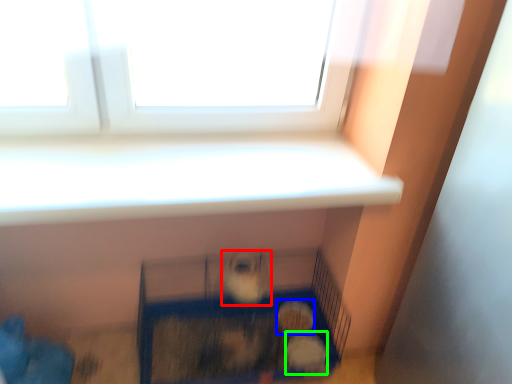
Question: Considering the real-world distances, which object is farthest from animal (highlighted by a red box)? animal (highlighted by a blue box) or animal (highlighted by a green box)?

Choices:
 (A) animal
 (B) animal

Answer: (B)